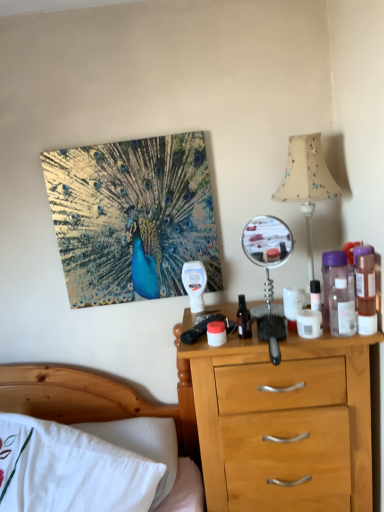
Question: Is shiny metallic peacock at upper left not close to white cotton bed at lower left?

Choices:
 (A) no
 (B) yes

Answer: (A)

Question: Can you confirm if shiny metallic peacock at upper left is taller than white cotton bed at lower left?

Choices:
 (A) yes
 (B) no

Answer: (B)

Question: Considering the relative sizes of shiny metallic peacock at upper left and white cotton bed at lower left in the image provided, is shiny metallic peacock at upper left shorter than white cotton bed at lower left?

Choices:
 (A) no
 (B) yes

Answer: (B)

Question: Does shiny metallic peacock at upper left appear on the right side of white cotton bed at lower left?

Choices:
 (A) yes
 (B) no

Answer: (A)

Question: From a real-world perspective, does shiny metallic peacock at upper left stand above white cotton bed at lower left?

Choices:
 (A) no
 (B) yes

Answer: (B)

Question: Considering the positions of point (249, 330) and point (342, 261), is point (249, 330) closer or farther from the camera than point (342, 261)?

Choices:
 (A) closer
 (B) farther

Answer: (A)

Question: Would you say transparent glass bottle at center, the fourth bottle positioned from the right, is to the left or to the right of purple translucent bottle at right, the 3th bottle from the right, in the picture?

Choices:
 (A) left
 (B) right

Answer: (A)

Question: Considering their positions, is transparent glass bottle at center, the fourth bottle positioned from the right, located in front of or behind purple translucent bottle at right, which ranks as the second bottle in left-to-right order?

Choices:
 (A) front
 (B) behind

Answer: (B)

Question: Looking at their shapes, would you say transparent glass bottle at center, the 1th bottle viewed from the left, is wider or thinner than purple translucent bottle at right, which ranks as the second bottle in left-to-right order?

Choices:
 (A) wide
 (B) thin

Answer: (B)

Question: Does point (91, 291) appear closer or farther from the camera than point (66, 375)?

Choices:
 (A) farther
 (B) closer

Answer: (B)

Question: From a real-world perspective, is shiny metallic peacock at upper left above or below white cotton bed at lower left?

Choices:
 (A) below
 (B) above

Answer: (B)

Question: Is shiny metallic peacock at upper left inside or outside of white cotton bed at lower left?

Choices:
 (A) inside
 (B) outside

Answer: (B)

Question: Looking at their shapes, would you say shiny metallic peacock at upper left is wider or thinner than white cotton bed at lower left?

Choices:
 (A) wide
 (B) thin

Answer: (B)

Question: In terms of size, does transparent plastic bottle at right, which is the third bottle from left to right, appear bigger or smaller than beige fabric lampshade at upper right?

Choices:
 (A) big
 (B) small

Answer: (B)

Question: From the image's perspective, is transparent plastic bottle at right, acting as the 2th bottle starting from the right, above or below beige fabric lampshade at upper right?

Choices:
 (A) below
 (B) above

Answer: (A)